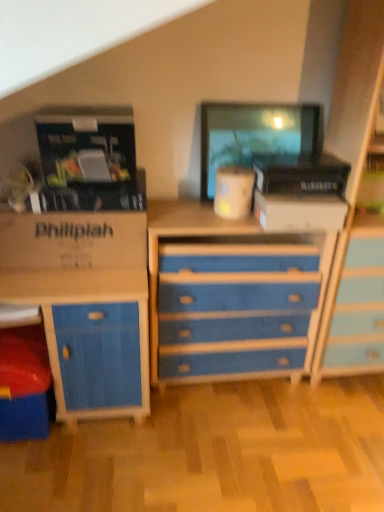
Question: Is matte black monitor at upper center oriented away from brown cardboard box at left?

Choices:
 (A) yes
 (B) no

Answer: (B)

Question: Does matte black monitor at upper center have a greater height compared to brown cardboard box at left?

Choices:
 (A) yes
 (B) no

Answer: (A)

Question: Does matte black monitor at upper center come in front of brown cardboard box at left?

Choices:
 (A) no
 (B) yes

Answer: (A)

Question: Can you confirm if matte black monitor at upper center is smaller than brown cardboard box at left?

Choices:
 (A) yes
 (B) no

Answer: (A)

Question: Does matte black monitor at upper center have a lesser width compared to brown cardboard box at left?

Choices:
 (A) yes
 (B) no

Answer: (A)

Question: From the image's perspective, is matte black monitor at upper center on brown cardboard box at left?

Choices:
 (A) no
 (B) yes

Answer: (B)

Question: Considering the relative sizes of brown cardboard box at left and white cardboard box at center in the image provided, is brown cardboard box at left wider than white cardboard box at center?

Choices:
 (A) no
 (B) yes

Answer: (A)

Question: Is brown cardboard box at left facing towards white cardboard box at center?

Choices:
 (A) yes
 (B) no

Answer: (B)

Question: Considering the relative positions of brown cardboard box at left and white cardboard box at center in the image provided, is brown cardboard box at left in front of white cardboard box at center?

Choices:
 (A) yes
 (B) no

Answer: (A)

Question: Can you confirm if brown cardboard box at left is positioned to the left of white cardboard box at center?

Choices:
 (A) no
 (B) yes

Answer: (B)

Question: Is brown cardboard box at left turned away from white cardboard box at center?

Choices:
 (A) no
 (B) yes

Answer: (A)

Question: From the image's perspective, is brown cardboard box at left located above white cardboard box at center?

Choices:
 (A) yes
 (B) no

Answer: (B)

Question: Is brown cardboard box at left located within white cardboard box at center?

Choices:
 (A) no
 (B) yes

Answer: (A)